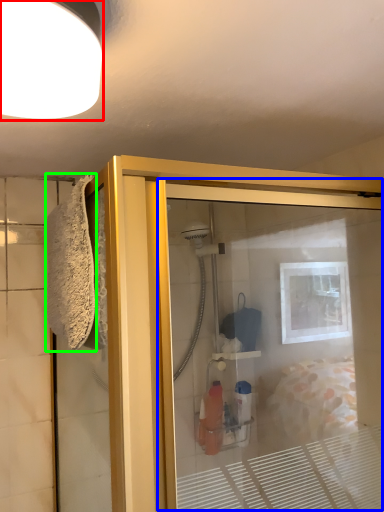
Question: Which object is the closest to the light fixture (highlighted by a red box)? Choose among these: screen door (highlighted by a blue box) or bath towel (highlighted by a green box).

Choices:
 (A) screen door
 (B) bath towel

Answer: (B)